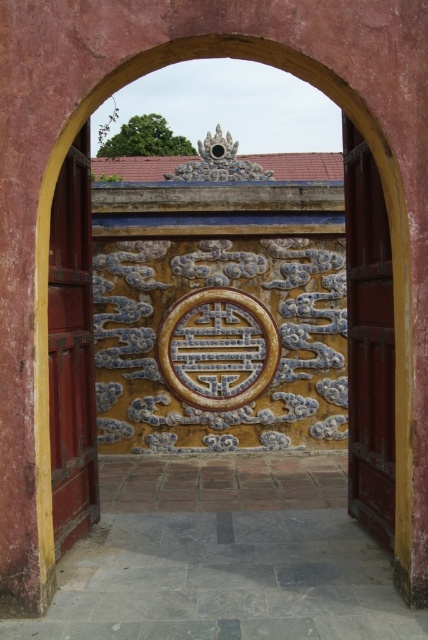
Question: Does smooth red wood door at right lie in front of smooth red wood door at left?

Choices:
 (A) yes
 (B) no

Answer: (B)

Question: Does smooth red wood door at right appear on the left side of smooth red wood door at left?

Choices:
 (A) no
 (B) yes

Answer: (A)

Question: Which point appears closest to the camera in this image?

Choices:
 (A) (91, 504)
 (B) (350, 314)

Answer: (A)

Question: Is smooth red wood door at right closer to camera compared to smooth red wood door at left?

Choices:
 (A) yes
 (B) no

Answer: (B)